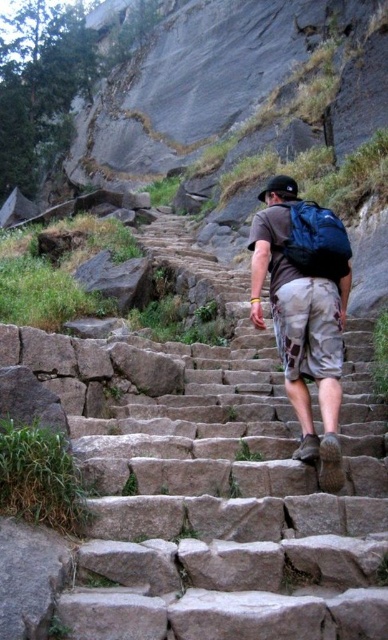
In the scene shown: Can you confirm if camouflage shorts at center is positioned to the left of matte blue backpack at upper center?

Indeed, camouflage shorts at center is positioned on the left side of matte blue backpack at upper center.

Does camouflage shorts at center appear over matte blue backpack at upper center?

Correct, camouflage shorts at center is located above matte blue backpack at upper center.

Is point (287, 211) behind point (277, 248)?

Yes, point (287, 211) is farther from viewer.

Identify the location of camouflage shorts at center. (303, 320).

Can you confirm if gray stone stairs at center is positioned above matte blue backpack at upper center?

No, gray stone stairs at center is not above matte blue backpack at upper center.

Is gray stone stairs at center below matte blue backpack at upper center?

Correct, gray stone stairs at center is located below matte blue backpack at upper center.

Which is behind, point (188, 452) or point (316, 221)?

The point (316, 221) is behind.

Where is `gray stone stairs at center`? gray stone stairs at center is located at coordinates (202, 483).

Is gray stone stairs at center thinner than camouflage shorts at center?

No, gray stone stairs at center is not thinner than camouflage shorts at center.

Consider the image. Who is lower down, gray stone stairs at center or camouflage shorts at center?

Positioned lower is gray stone stairs at center.

Who is more forward, (346,566) or (280,296)?

Point (346,566)

I want to click on gray stone stairs at center, so pyautogui.click(x=202, y=483).